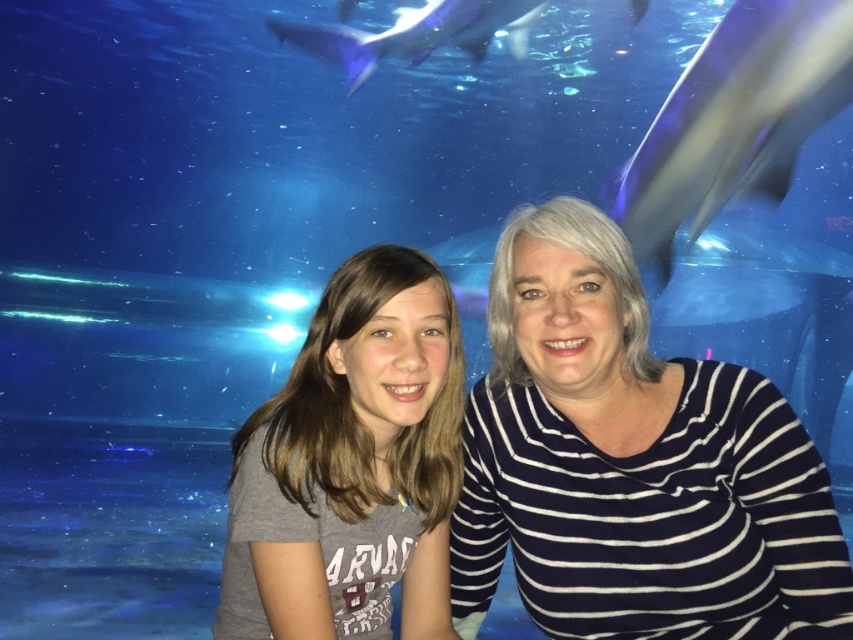
You are designing a new mannequin stand for a clothing store. The stand needs to support both the gray matte shirt at center and the blue smooth shark at upper center. If the stand has a width of 10 cm, will it be sufficient to hold both items side by side?

The gray matte shirt at center is thinner than the blue smooth shark at upper center, but the combined width of both items is not provided. Without knowing the exact dimensions of each item, it is impossible to determine if the 10 cm stand width is sufficient.

Looking at this image, you are a photographer trying to capture a clear shot of both the gray matte shirt at center and the blue smooth shark at upper center. Given their sizes in the frame, which object will appear smaller in your photo?

The gray matte shirt at center will appear smaller in the photo because it occupies less space than the blue smooth shark at upper center according to the description.

You are a photographer trying to position two models for a photo shoot in an aquarium. You have two models wearing the white striped shirt at center and the gray matte shirt at center. According to the scene, which model should stand on the left side to match the original image?

The gray matte shirt at center should stand on the left side because the white striped shirt at center is to the right of it in the original image.